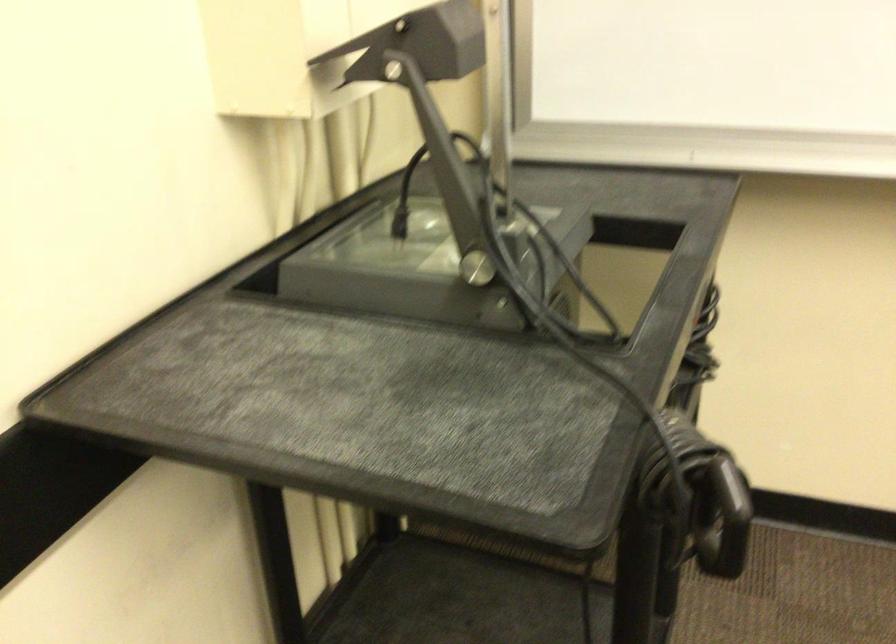
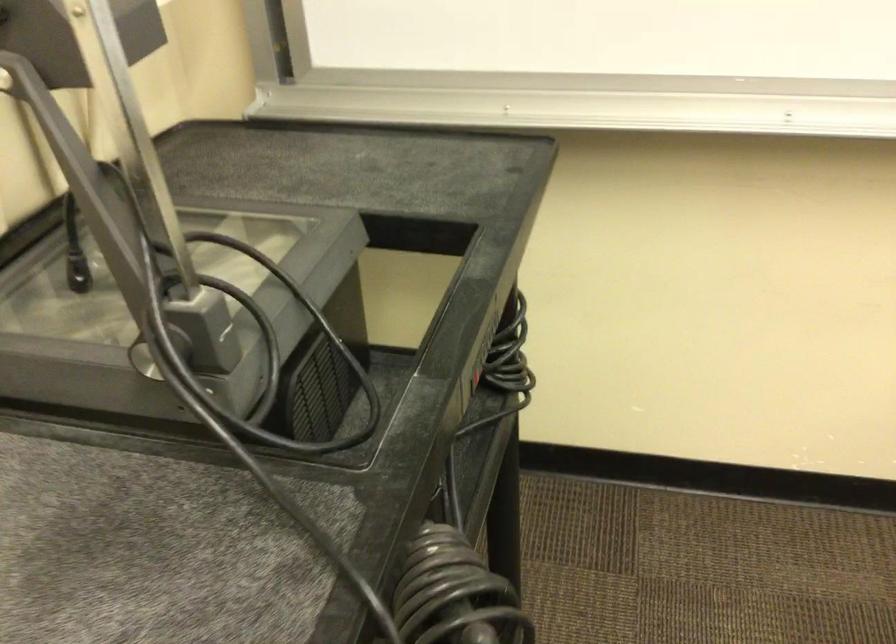
Question: The first image is from the beginning of the video and the second image is from the end. How did the camera likely rotate when shooting the video?

Choices:
 (A) Left
 (B) Right
 (C) Up
 (D) Down

Answer: (D)